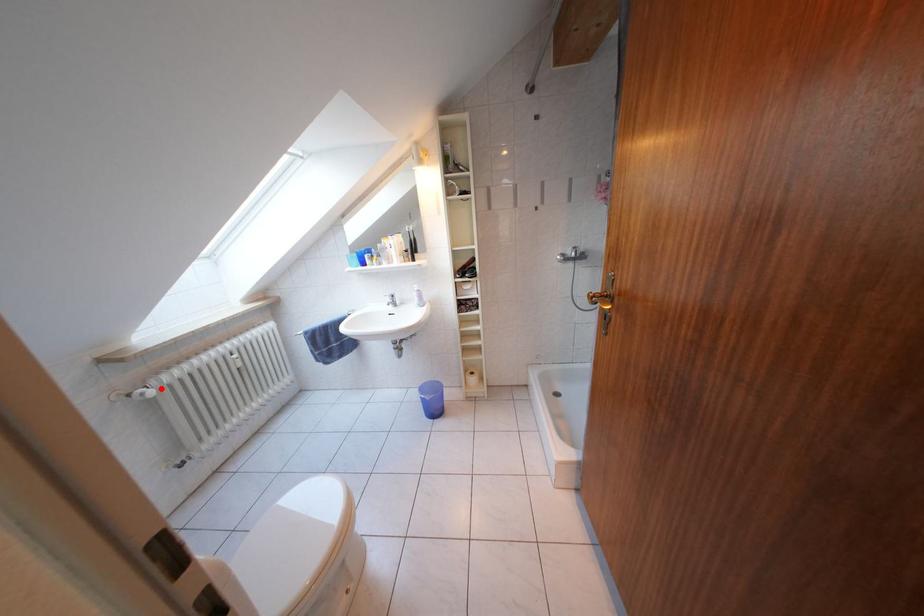
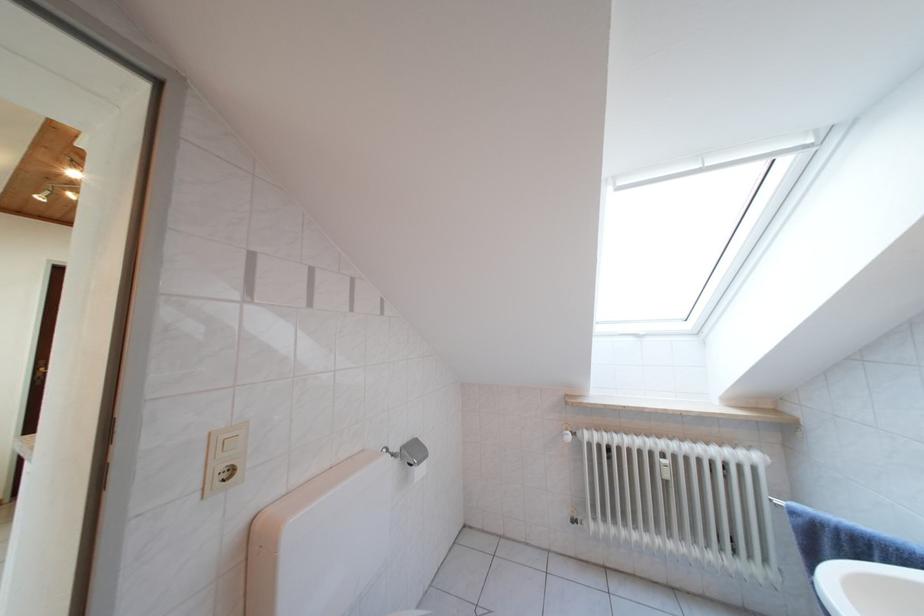
Question: I am providing you with two images of the same scene from different viewpoints. A red point is shown in image1. For the corresponding object point in image2, is it positioned nearer or farther from the camera?

Choices:
 (A) Nearer
 (B) Farther

Answer: (B)